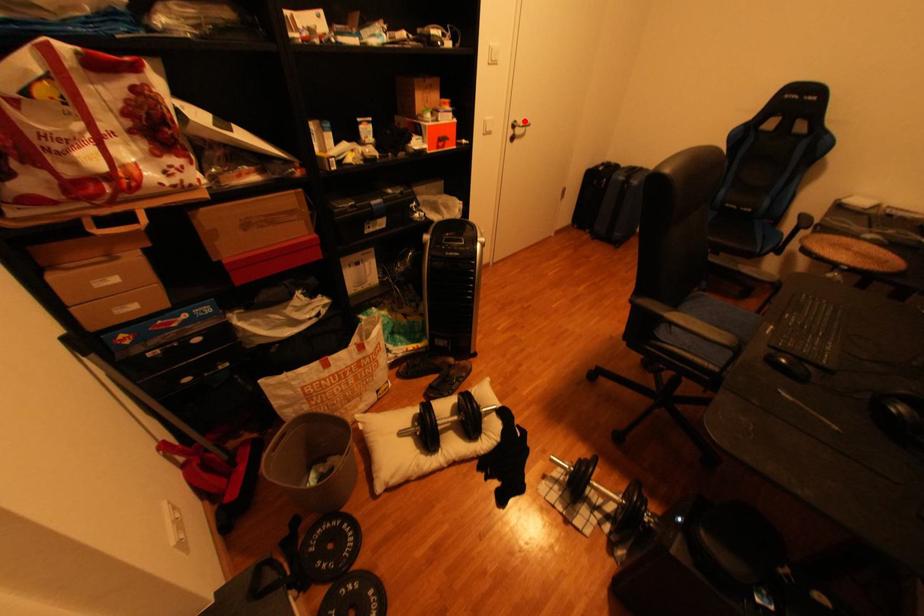
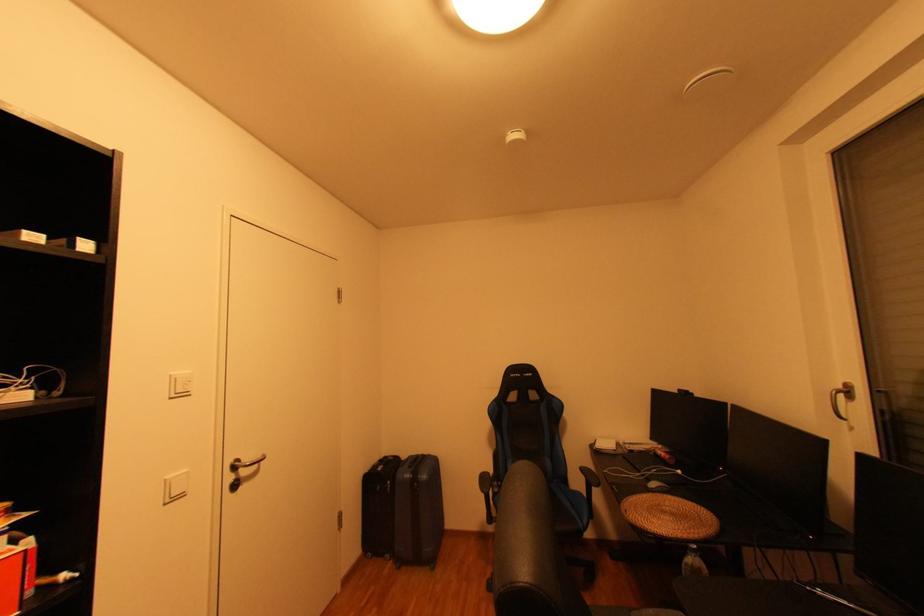
Locate, in the second image, the point that corresponds to the highlighted location in the first image.

(247, 461)